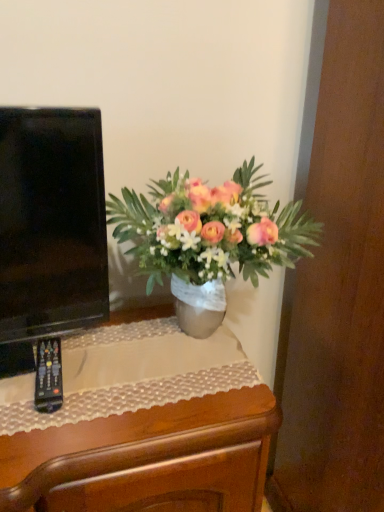
Question: Is wooden desk at center smaller than metallic silver vase at center?

Choices:
 (A) yes
 (B) no

Answer: (B)

Question: Is wooden desk at center shorter than metallic silver vase at center?

Choices:
 (A) yes
 (B) no

Answer: (A)

Question: Is wooden desk at center not close to metallic silver vase at center?

Choices:
 (A) yes
 (B) no

Answer: (B)

Question: Does wooden desk at center have a greater width compared to metallic silver vase at center?

Choices:
 (A) no
 (B) yes

Answer: (B)

Question: From a real-world perspective, is wooden desk at center on top of metallic silver vase at center?

Choices:
 (A) no
 (B) yes

Answer: (A)

Question: Is wooden desk at center in front of or behind black plastic remote at lower left in the image?

Choices:
 (A) front
 (B) behind

Answer: (A)

Question: In terms of size, does wooden desk at center appear bigger or smaller than black plastic remote at lower left?

Choices:
 (A) small
 (B) big

Answer: (B)

Question: Is point (178, 455) positioned closer to the camera than point (56, 377)?

Choices:
 (A) farther
 (B) closer

Answer: (B)

Question: Based on their positions, is wooden desk at center located to the left or right of black plastic remote at lower left?

Choices:
 (A) right
 (B) left

Answer: (A)

Question: Is point (196, 477) positioned closer to the camera than point (125, 190)?

Choices:
 (A) farther
 (B) closer

Answer: (B)

Question: Looking at their shapes, would you say wooden desk at center is wider or thinner than metallic silver vase at center?

Choices:
 (A) thin
 (B) wide

Answer: (B)

Question: Is wooden desk at center taller or shorter than metallic silver vase at center?

Choices:
 (A) short
 (B) tall

Answer: (A)

Question: Is wooden desk at center spatially inside metallic silver vase at center, or outside of it?

Choices:
 (A) inside
 (B) outside

Answer: (B)

Question: Based on their positions, is black plastic remote at lower left located to the left or right of wooden desk at center?

Choices:
 (A) left
 (B) right

Answer: (A)

Question: Is point (39, 366) positioned closer to the camera than point (213, 479)?

Choices:
 (A) farther
 (B) closer

Answer: (A)